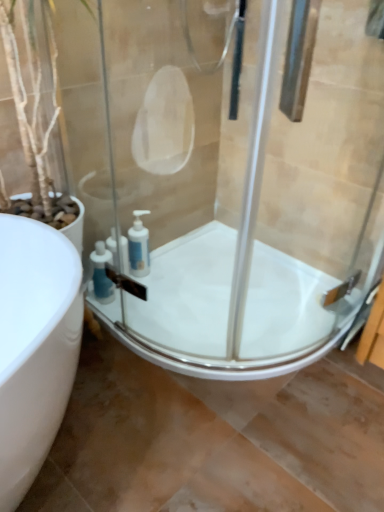
Image resolution: width=384 pixels, height=512 pixels. I want to click on vacant space to the right of white glossy soap dispenser at corner, arranged as the second soap dispenser when viewed from the left, so click(173, 281).